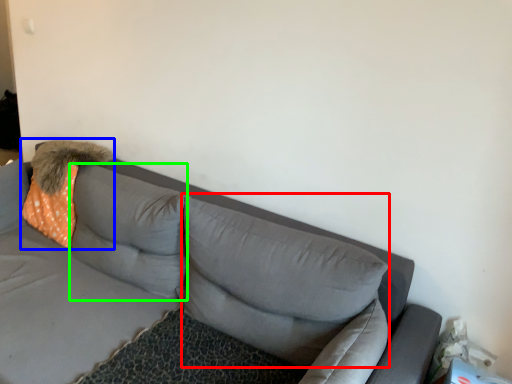
Question: Which object is the closest to the pillow (highlighted by a red box)? Choose among these: throw pillow (highlighted by a blue box) or pillow (highlighted by a green box).

Choices:
 (A) throw pillow
 (B) pillow

Answer: (B)